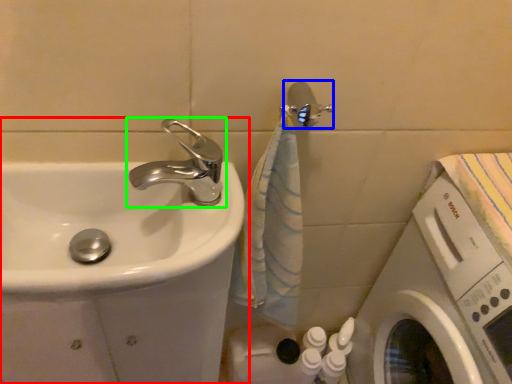
Question: Considering the real-world distances, which object is farthest from sink (highlighted by a red box)? shower (highlighted by a blue box) or tap (highlighted by a green box)?

Choices:
 (A) shower
 (B) tap

Answer: (A)